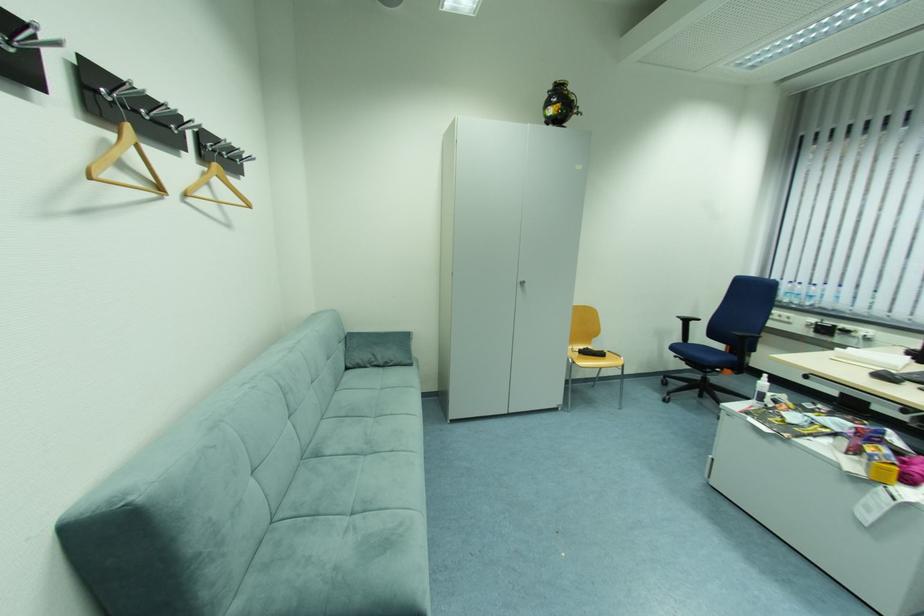
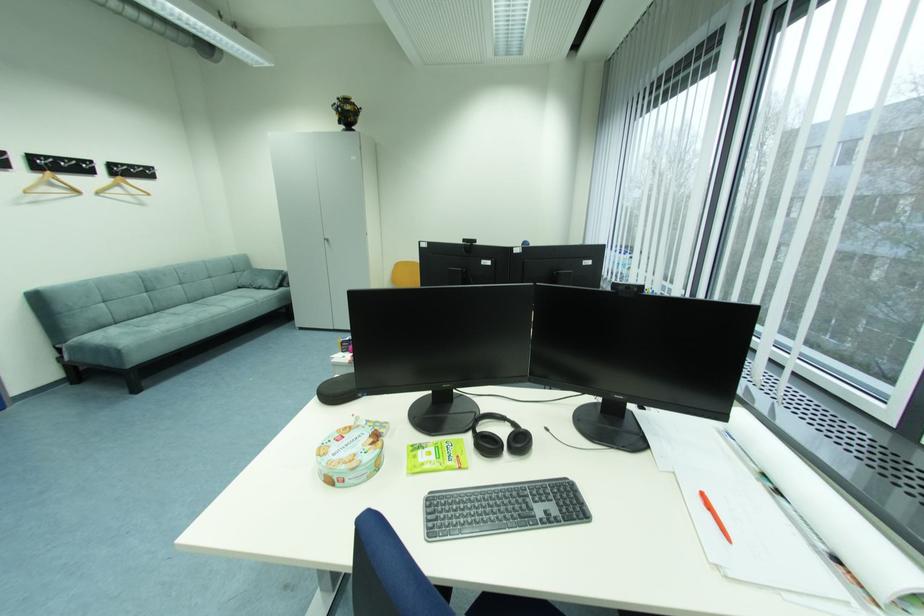
Question: I am providing you with two images of the same scene from different viewpoints. After the viewpoint changes to image2, which objects are now occluded?

Choices:
 (A) cabinet door handle
 (B) black bag handles
 (C) black headphones
 (D) plastic water bottle

Answer: (D)